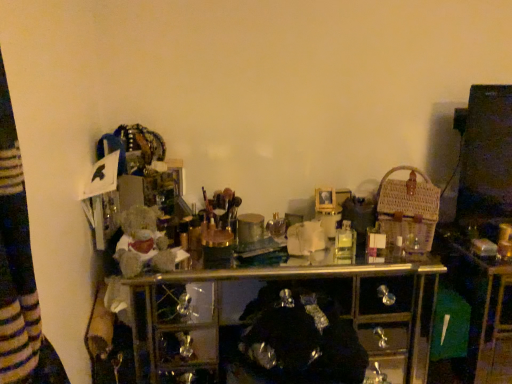
What is the approximate width of woven brown basket at right?

woven brown basket at right is 10.80 inches wide.

The image size is (512, 384). What do you see at coordinates (408, 196) in the screenshot? I see `woven brown basket at right` at bounding box center [408, 196].

This screenshot has height=384, width=512. Find the location of `woven brown basket at right`. woven brown basket at right is located at coordinates (408, 196).

What do you see at coordinates (483, 305) in the screenshot? I see `clear plastic bottle at center` at bounding box center [483, 305].

At what (x,y) coordinates should I click in order to perform the action: click on clear plastic bottle at center. Please return your answer as a coordinate pair (x, y). The image size is (512, 384). Looking at the image, I should click on (483, 305).

Identify the location of woven brown basket at right. This screenshot has height=384, width=512. (408, 196).

Is woven brown basket at right to the right of clear plastic bottle at center from the viewer's perspective?

No.

Considering the positions of objects woven brown basket at right and clear plastic bottle at center in the image provided, who is in front, woven brown basket at right or clear plastic bottle at center?

clear plastic bottle at center is in front.

Which is behind, point (401, 188) or point (496, 320)?

Point (401, 188)

From the image's perspective, which is above, woven brown basket at right or clear plastic bottle at center?

woven brown basket at right.

From a real-world perspective, which is physically above, woven brown basket at right or clear plastic bottle at center?

woven brown basket at right, from a real-world perspective.

Considering the sizes of objects woven brown basket at right and clear plastic bottle at center in the image provided, who is wider, woven brown basket at right or clear plastic bottle at center?

clear plastic bottle at center.

Which of these two, woven brown basket at right or clear plastic bottle at center, stands shorter?

woven brown basket at right is shorter.

Which of these two, woven brown basket at right or clear plastic bottle at center, is bigger?

With larger size is clear plastic bottle at center.

Is woven brown basket at right surrounding clear plastic bottle at center?

No, woven brown basket at right does not contain clear plastic bottle at center.

Consider the image. Is woven brown basket at right touching clear plastic bottle at center?

No, woven brown basket at right is not next to clear plastic bottle at center.

Is clear plastic bottle at center at the back of woven brown basket at right?

No.

This screenshot has height=384, width=512. In order to click on basket on the left side of clear plastic bottle at center in this screenshot , I will do `click(408, 196)`.

Is clear plastic bottle at center to the left of woven brown basket at right from the viewer's perspective?

No.

In the scene shown: Which object is further away from the camera, clear plastic bottle at center or woven brown basket at right?

woven brown basket at right is behind.

Which is more distant, (466,285) or (422,216)?

The point (466,285) is behind.

From the image's perspective, which one is positioned higher, clear plastic bottle at center or woven brown basket at right?

woven brown basket at right appears higher in the image.

From a real-world perspective, between clear plastic bottle at center and woven brown basket at right, who is vertically lower?

From a 3D spatial view, clear plastic bottle at center is below.

Can you confirm if clear plastic bottle at center is thinner than woven brown basket at right?

No.

Can you confirm if clear plastic bottle at center is shorter than woven brown basket at right?

No, clear plastic bottle at center is not shorter than woven brown basket at right.

Is clear plastic bottle at center bigger than woven brown basket at right?

Yes.

Do you think clear plastic bottle at center is within woven brown basket at right, or outside of it?

clear plastic bottle at center is outside woven brown basket at right.

Is clear plastic bottle at center far from woven brown basket at right?

No, clear plastic bottle at center is in close proximity to woven brown basket at right.

Could you tell me if clear plastic bottle at center is facing woven brown basket at right?

No.

What's the angular difference between clear plastic bottle at center and woven brown basket at right's facing directions?

There is a 23.2-degree angle between the facing directions of clear plastic bottle at center and woven brown basket at right.

Locate an element on the screen. basket above the clear plastic bottle at center (from a real-world perspective) is located at coordinates [x=408, y=196].

Locate an element on the screen. computer desk that is in front of the woven brown basket at right is located at coordinates (483, 305).

The height and width of the screenshot is (384, 512). Find the location of `basket that is on the left side of clear plastic bottle at center`. basket that is on the left side of clear plastic bottle at center is located at coordinates (408, 196).